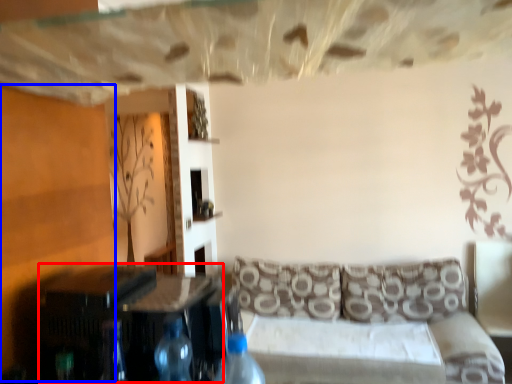
Question: Which point is closer to the camera, table (highlighted by a red box) or plywood (highlighted by a blue box)?

Choices:
 (A) table
 (B) plywood

Answer: (A)